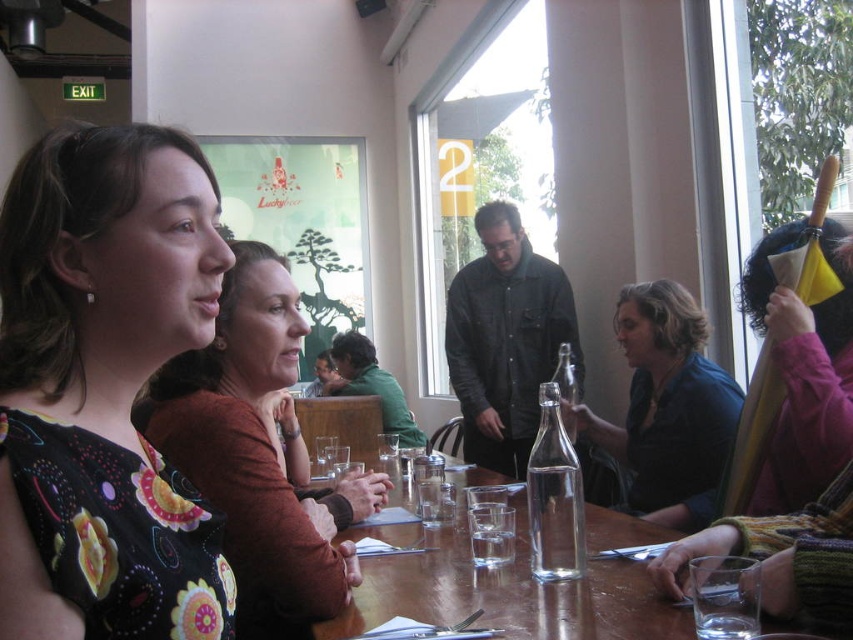
Question: Is floral print dress at center thinner than floral dress at center?

Choices:
 (A) no
 (B) yes

Answer: (B)

Question: Does floral print dress at center have a larger size compared to floral dress at center?

Choices:
 (A) no
 (B) yes

Answer: (A)

Question: Is floral print dress at center above wooden table at center?

Choices:
 (A) yes
 (B) no

Answer: (A)

Question: Which object is farther from the camera taking this photo?

Choices:
 (A) wooden table at center
 (B) floral dress at center

Answer: (A)

Question: Which point is farther to the camera?

Choices:
 (A) (589, 608)
 (B) (96, 592)
 (C) (723, 442)

Answer: (C)

Question: Which is farther from the matte black shirt at center?

Choices:
 (A) floral dress at center
 (B) wooden table at center
 (C) floral print dress at center

Answer: (C)